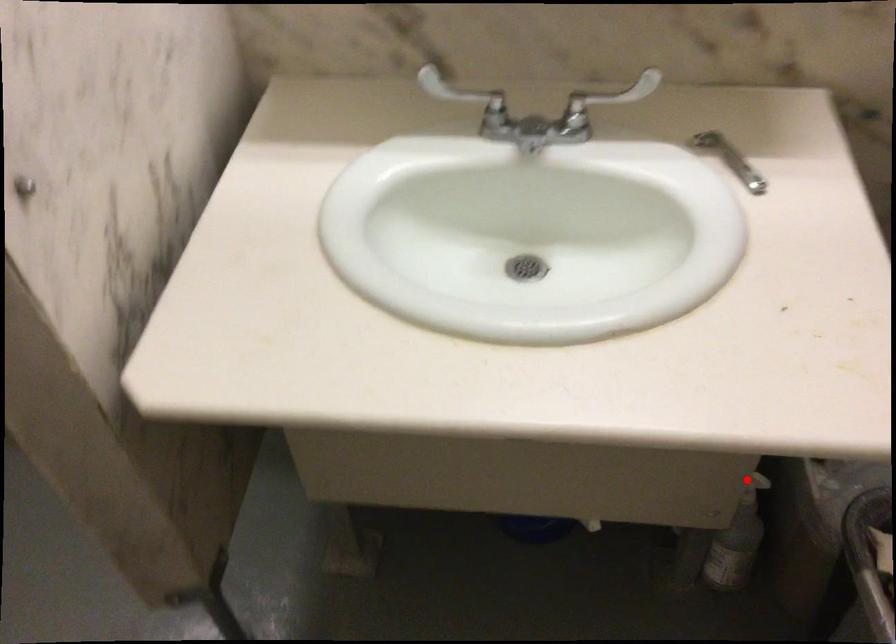
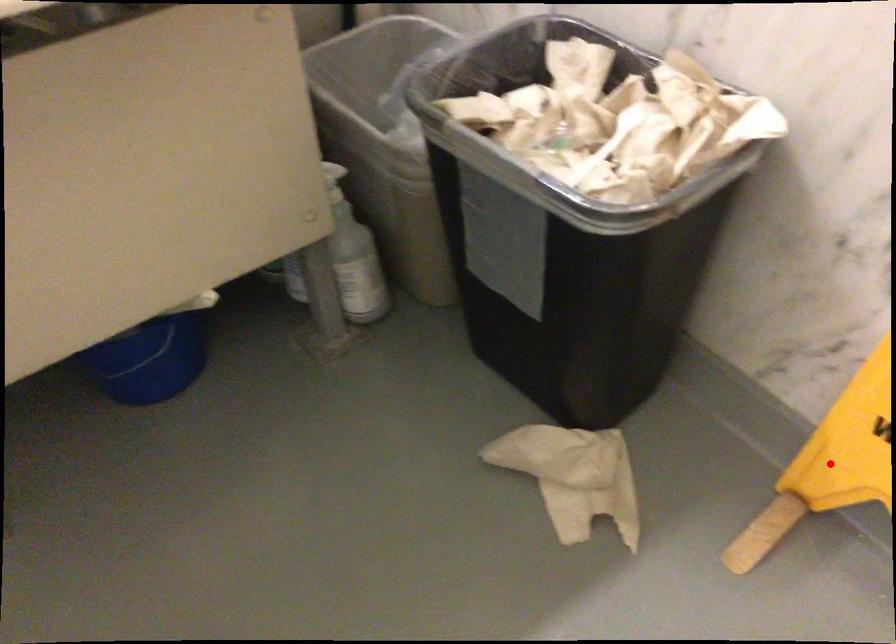
I am providing you with two images of the same scene from different viewpoints. A red point is marked on the first image and another point is marked on the second image. Is the marked point in image1 the same physical position as the marked point in image2?

No